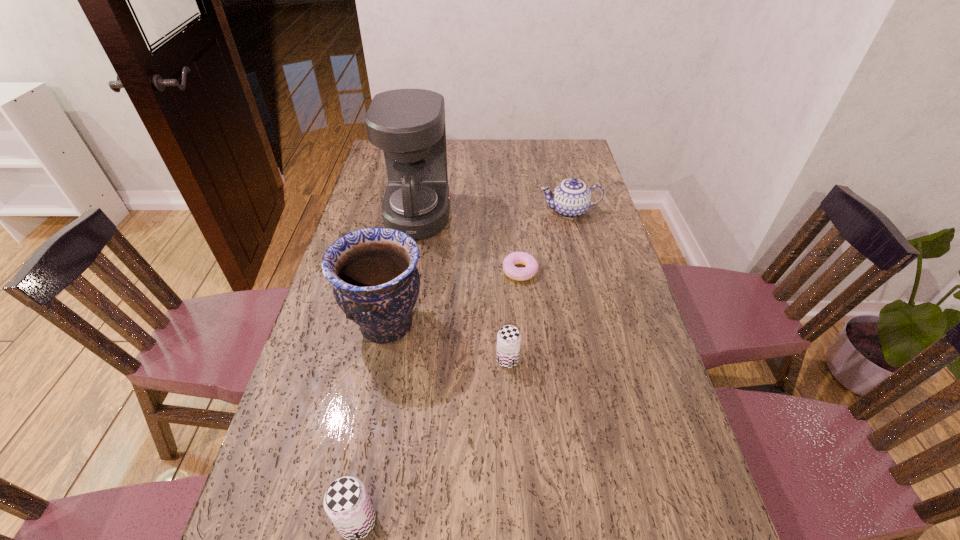
Locate an element on the screen. This screenshot has width=960, height=540. the shorter beer can is located at coordinates (508, 338).

Find the location of a particular element. This screenshot has width=960, height=540. the farther beer can is located at coordinates (508, 338).

At what (x,y) coordinates should I click in order to perform the action: click on the rightmost object. Please return your answer as a coordinate pair (x, y). Looking at the image, I should click on (571, 198).

The image size is (960, 540). Identify the location of pottery. (376, 283).

In order to click on the fourth nearest object in this screenshot , I will do `click(519, 274)`.

Identify the location of the shortest object. The width and height of the screenshot is (960, 540). (519, 274).

Where is `the tallest object`? the tallest object is located at coordinates (408, 125).

This screenshot has height=540, width=960. In order to click on free space located on the right of the right beer can in this screenshot , I will do `click(629, 360)`.

The width and height of the screenshot is (960, 540). In order to click on free space located from the spout of the rightmost object in this screenshot , I will do (x=518, y=211).

Find the location of a particular element. The height and width of the screenshot is (540, 960). vacant space located from the spout of the rightmost object is located at coordinates (499, 211).